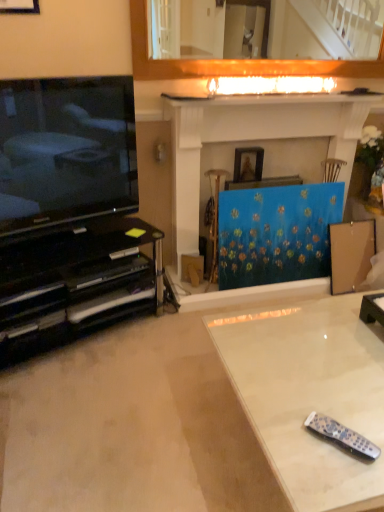
Where is `free space to the back side of black plastic remote at lower right`? The width and height of the screenshot is (384, 512). free space to the back side of black plastic remote at lower right is located at coordinates (322, 396).